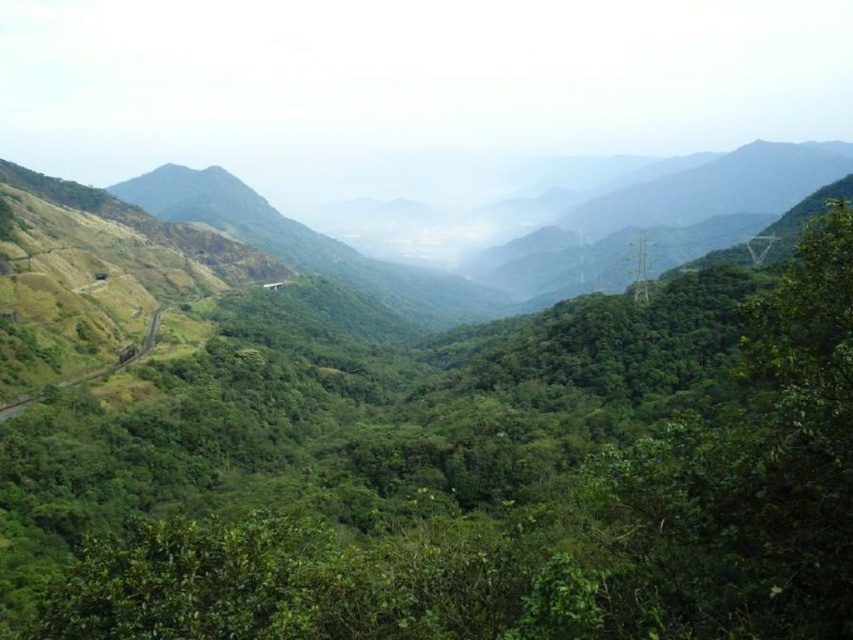
Is green leafy vegetation at center behind green grassy mountain path at left?

No.

Is point (297, 518) farther from viewer compared to point (33, 392)?

No, it is in front of (33, 392).

Image resolution: width=853 pixels, height=640 pixels. What do you see at coordinates (463, 476) in the screenshot?
I see `green leafy vegetation at center` at bounding box center [463, 476].

Image resolution: width=853 pixels, height=640 pixels. In order to click on green leafy vegetation at center in this screenshot , I will do `click(463, 476)`.